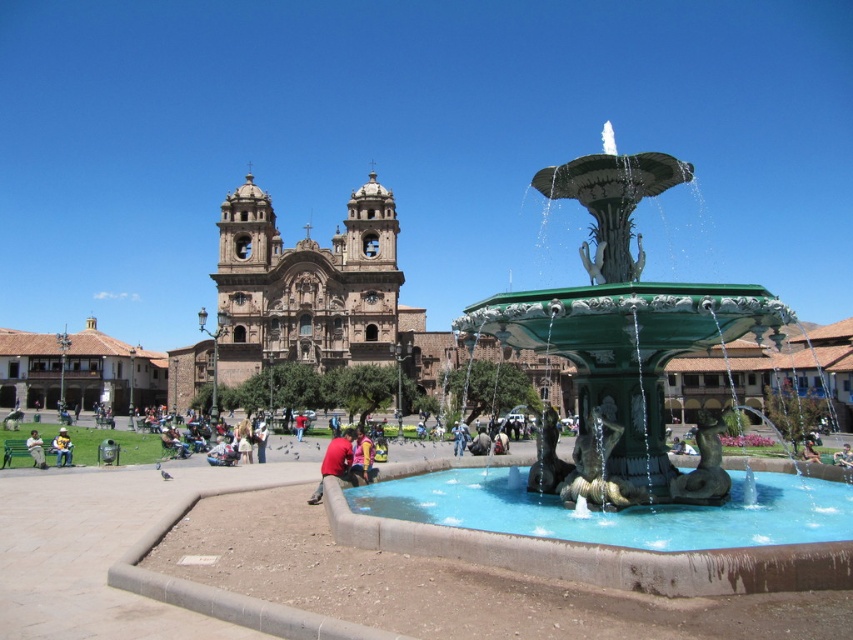
Question: Is light brown leather jacket at lower left wider than green marble statue at center?

Choices:
 (A) yes
 (B) no

Answer: (A)

Question: From the image, what is the correct spatial relationship of pink fabric at center in relation to yellow fabric jacket at lower left?

Choices:
 (A) right
 (B) left

Answer: (A)

Question: Is the position of pink fabric at center more distant than that of green marble statue at center?

Choices:
 (A) no
 (B) yes

Answer: (A)

Question: Which point is closer to the camera?

Choices:
 (A) (804, 451)
 (B) (321, 476)
 (C) (352, 307)

Answer: (B)

Question: Which object is positioned closest to the yellow fabric jacket at lower left?

Choices:
 (A) red matte shirt at lower center
 (B) green marble statue at center

Answer: (A)

Question: Which point is farther to the camera?

Choices:
 (A) (59, 451)
 (B) (334, 472)
 (C) (804, 445)
 (D) (389, 269)

Answer: (D)